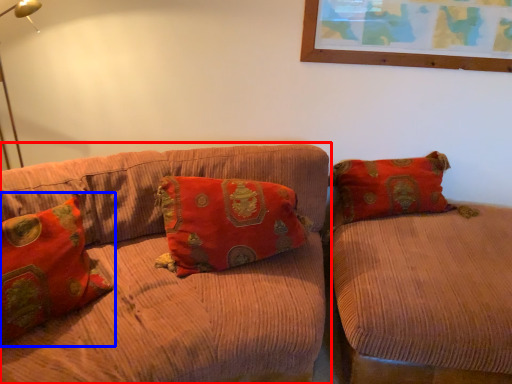
Question: Which of the following is the farthest to the observer, studio couch (highlighted by a red box) or pillow (highlighted by a blue box)?

Choices:
 (A) studio couch
 (B) pillow

Answer: (A)